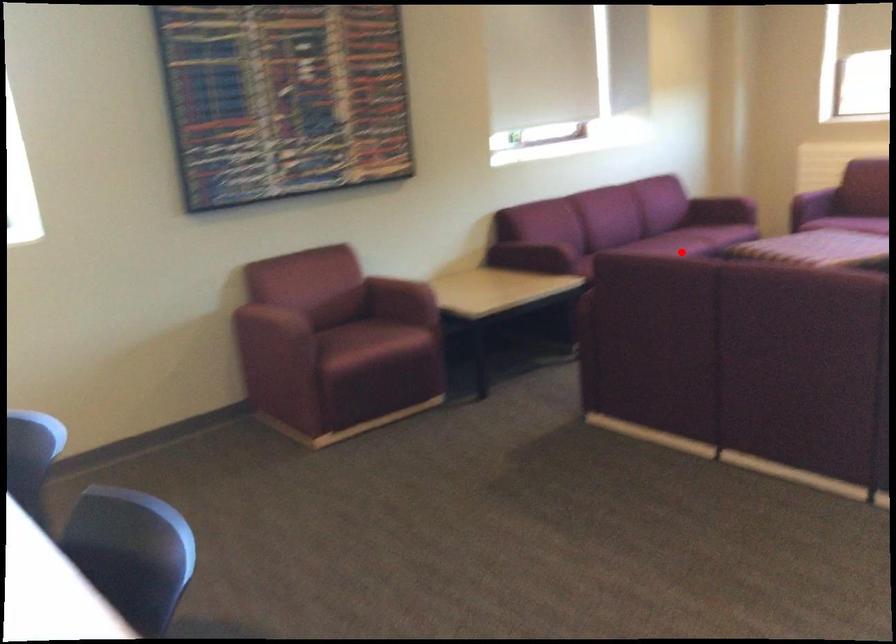
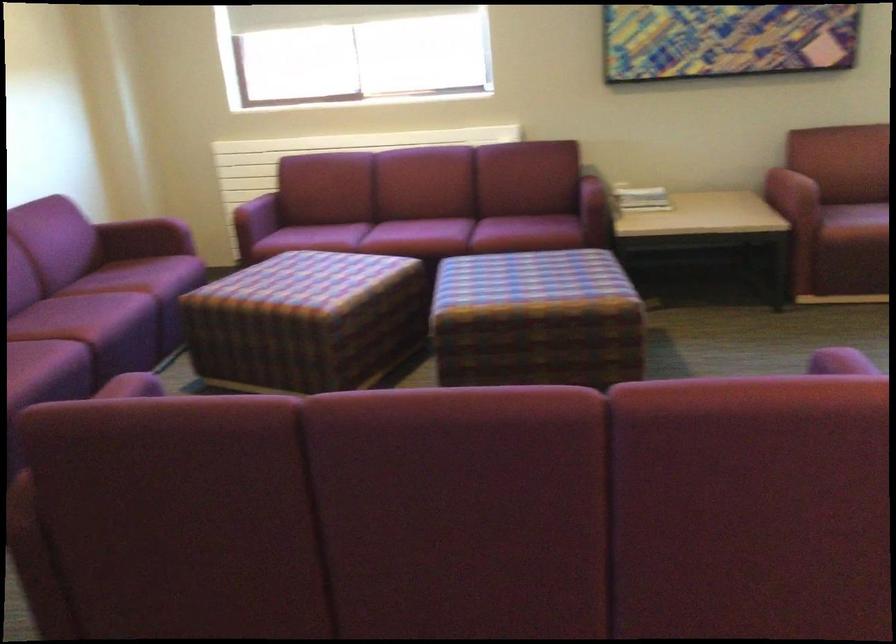
In the second image, find the point that corresponds to the highlighted location in the first image.

(116, 313)